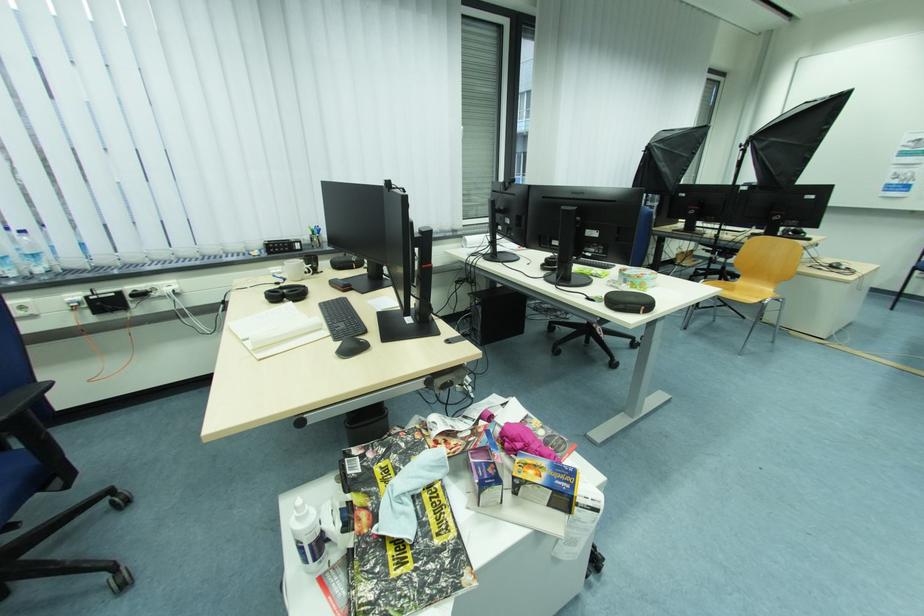
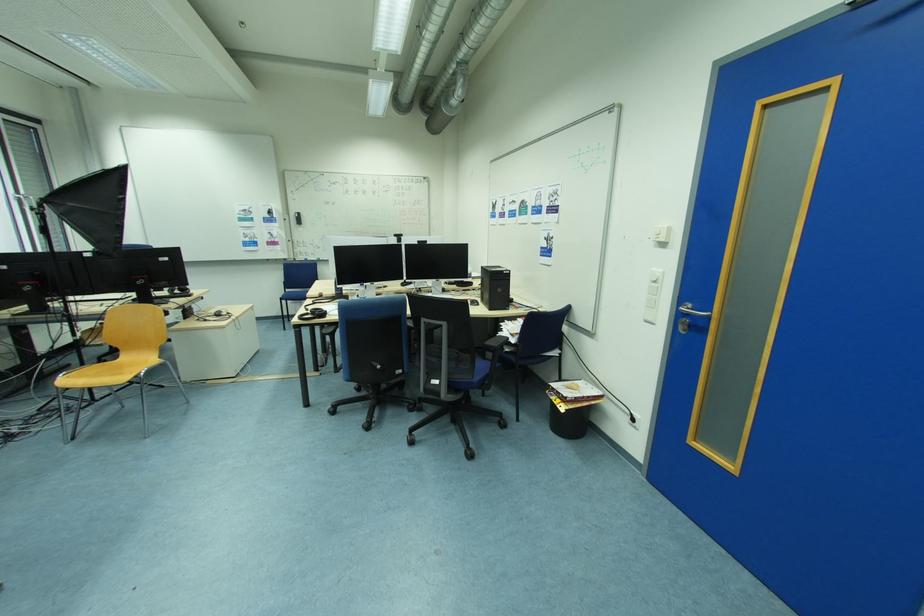
Find the pixel in the second image that matches point 710,282 in the first image.

(68, 377)